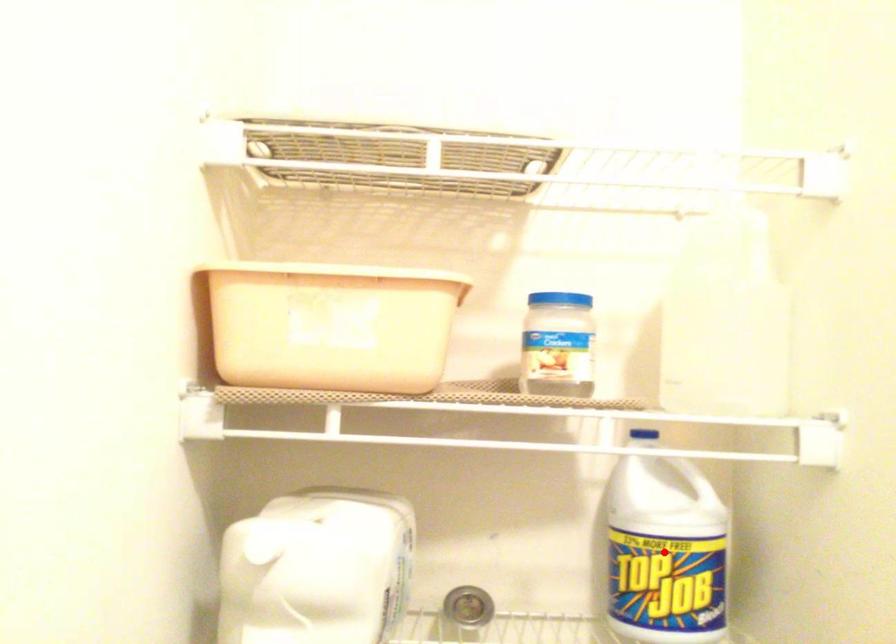
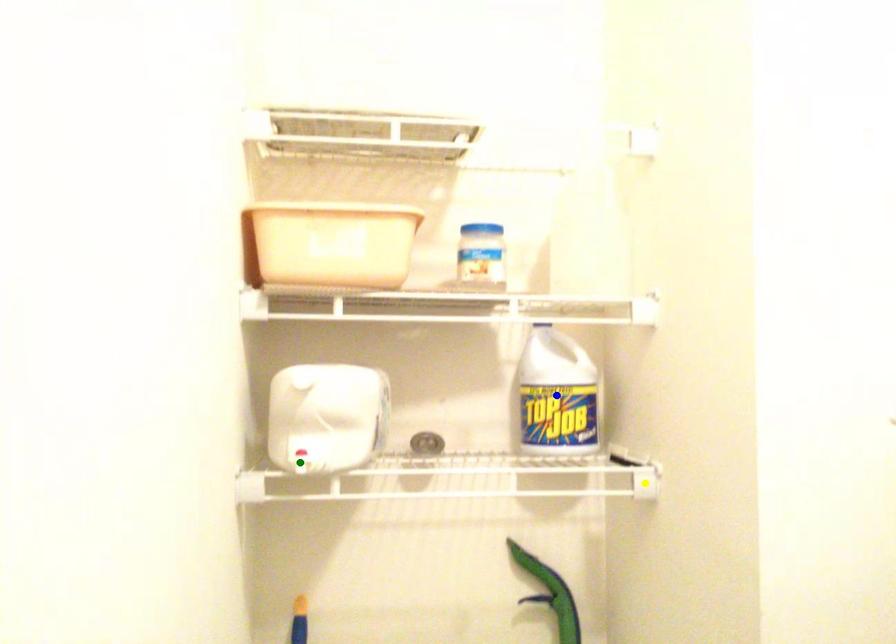
Question: I am providing you with two images of the same scene from different viewpoints. A red point is marked on the first image. You are given multiple points on the second image. Which point in image 2 is actually the same real-world point as the red point in image 1?

Choices:
 (A) green point
 (B) yellow point
 (C) blue point

Answer: (C)